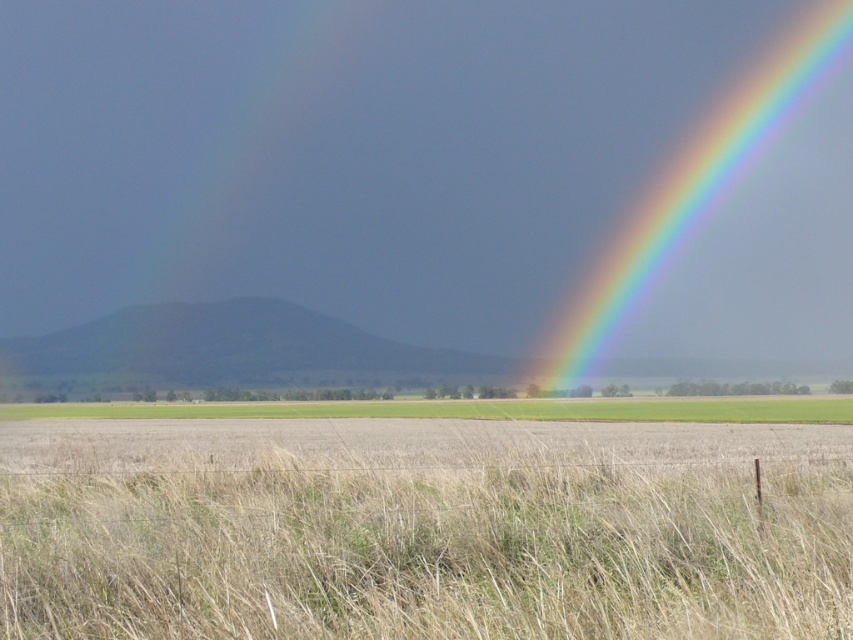
Question: Which of the following is the closest to the observer?

Choices:
 (A) (843, 609)
 (B) (715, 413)
 (C) (851, 236)

Answer: (A)

Question: Is dry grass at lower center wider than green grassland at center?

Choices:
 (A) yes
 (B) no

Answer: (B)

Question: Considering the relative positions of rainbow at upper right and green grassland at center in the image provided, where is rainbow at upper right located with respect to green grassland at center?

Choices:
 (A) below
 (B) above

Answer: (B)

Question: Estimate the real-world distances between objects in this image. Which object is farther from the rainbow at upper right?

Choices:
 (A) green grassland at center
 (B) dry grass at lower center

Answer: (B)

Question: Which object appears farthest from the camera in this image?

Choices:
 (A) dry grass at lower center
 (B) green grassland at center

Answer: (B)

Question: Is dry grass at lower center positioned at the back of rainbow at upper right?

Choices:
 (A) no
 (B) yes

Answer: (A)